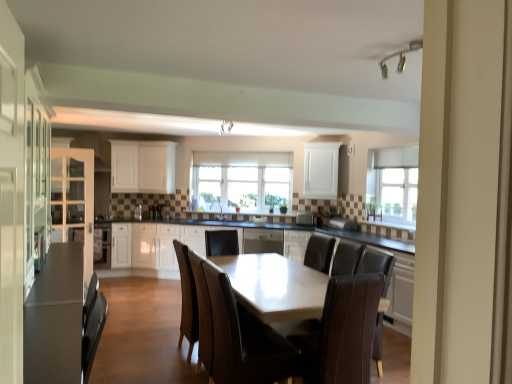
Where is `free spot above matte white table at center (from a real-world perspective)`? The image size is (512, 384). free spot above matte white table at center (from a real-world perspective) is located at coordinates (271, 278).